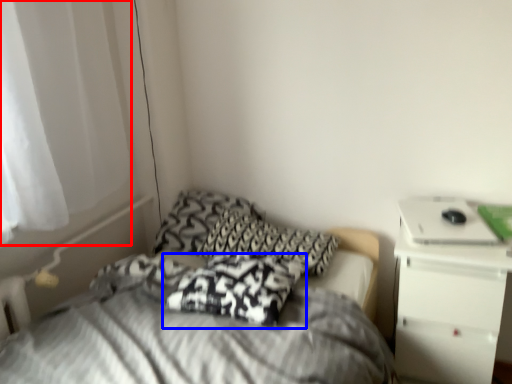
Question: Among these objects, which one is farthest to the camera, curtain (highlighted by a red box) or pillow (highlighted by a blue box)?

Choices:
 (A) curtain
 (B) pillow

Answer: (B)